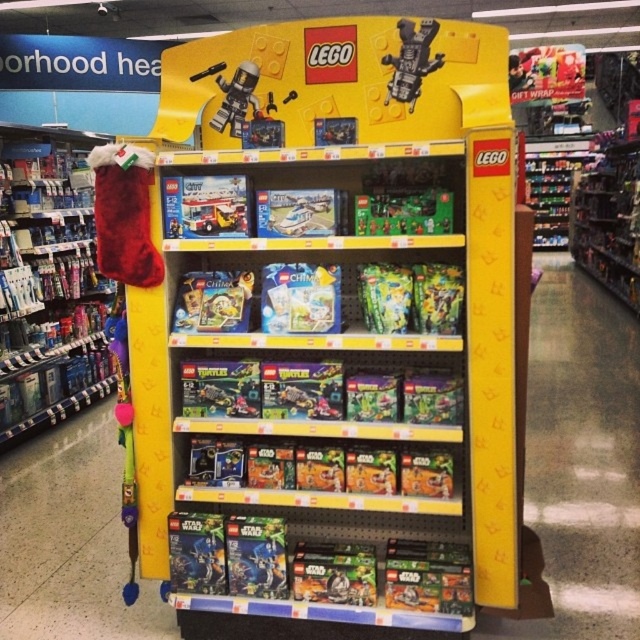
You are a store employee who needs to place a camera on the shelf so that it is exactly 4.06 meters away from the velvet red stocking at left. Is there enough space on the shelf to do this?

The velvet red stocking at left and camera are 4.06 meters apart, so yes, there is enough space on the shelf to place the camera exactly 4.06 meters away from the velvet red stocking at left.

Consider the image. You are a store employee trying to arrange the velvet red stocking at left and the metallic silver robot at upper center on a shelf. If the shelf has a width of 1 meter, can both items fit side by side without overlapping?

The velvet red stocking at left might be wider than metallic silver robot at upper center. Since their combined width could exceed 1 meter, it is uncertain if they will fit without overlapping. Check their exact dimensions before placing them.